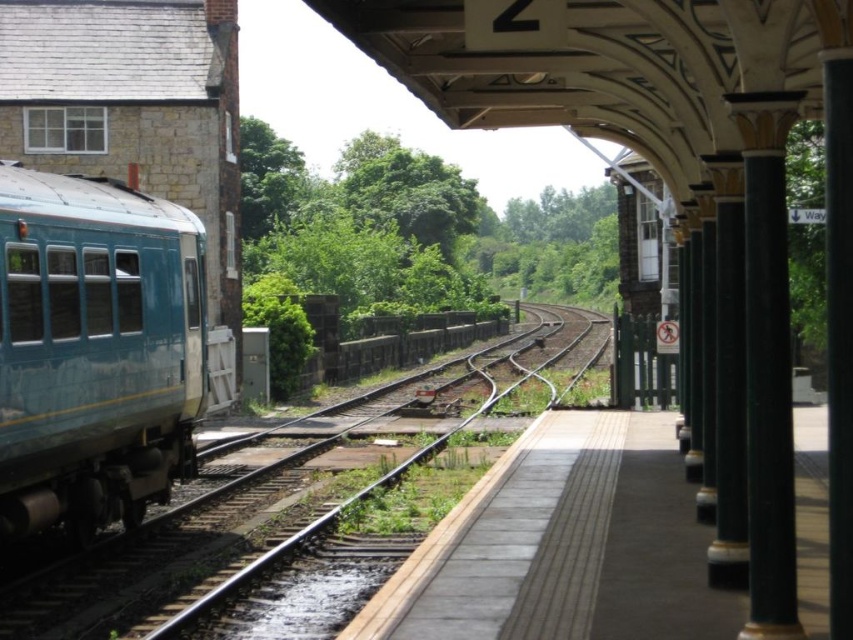
Question: Is green metallic train track at center smaller than smooth concrete platform at center?

Choices:
 (A) yes
 (B) no

Answer: (B)

Question: In this image, where is smooth concrete platform at center located relative to green polished stone column at right?

Choices:
 (A) above
 (B) below

Answer: (B)

Question: Which is farther from the green metallic train track at center?

Choices:
 (A) smooth concrete platform at center
 (B) green polished stone column at right
 (C) teal glossy train car at left

Answer: (B)

Question: Does teal glossy train car at left have a smaller size compared to green polished stone column at right?

Choices:
 (A) no
 (B) yes

Answer: (A)

Question: Which object is farther from the camera taking this photo?

Choices:
 (A) teal glossy train car at left
 (B) green metallic train track at center
 (C) green polished stone column at right

Answer: (B)

Question: Which point is closer to the camera?

Choices:
 (A) (769, 522)
 (B) (51, 410)
 (C) (230, 561)

Answer: (A)